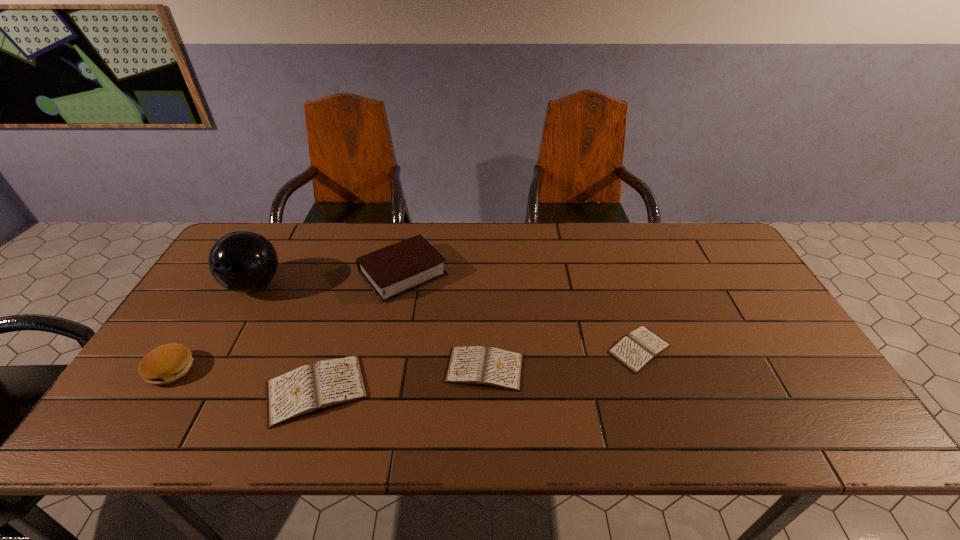
The width and height of the screenshot is (960, 540). I want to click on vacant area that lies between the Bible and the patty, so [287, 321].

Identify the location of vacant space in between the patty and the bowling ball. The height and width of the screenshot is (540, 960). (213, 327).

This screenshot has height=540, width=960. I want to click on unoccupied position between the fifth tallest object and the tallest object, so click(370, 327).

I want to click on free space between the fifth tallest object and the rightmost diary, so click(563, 359).

Locate an element on the screen. vacant point located between the second object from right to left and the Bible is located at coordinates (444, 321).

This screenshot has height=540, width=960. In order to click on free space between the leftmost diary and the patty in this screenshot , I will do `click(244, 380)`.

Where is `vacant space that's between the patty and the rightmost diary`? This screenshot has height=540, width=960. vacant space that's between the patty and the rightmost diary is located at coordinates (405, 359).

The image size is (960, 540). I want to click on object that stands as the fourth closest to the patty, so click(x=476, y=365).

Point out which object is positioned as the fourth nearest to the patty. Please provide its 2D coordinates. Your answer should be formatted as a tuple, i.e. [(x, y)], where the tuple contains the x and y coordinates of a point satisfying the conditions above.

[(476, 365)]

Locate which diary is the closest to the tallest diary. Please provide its 2D coordinates. Your answer should be formatted as a tuple, i.e. [(x, y)], where the tuple contains the x and y coordinates of a point satisfying the conditions above.

[(476, 365)]